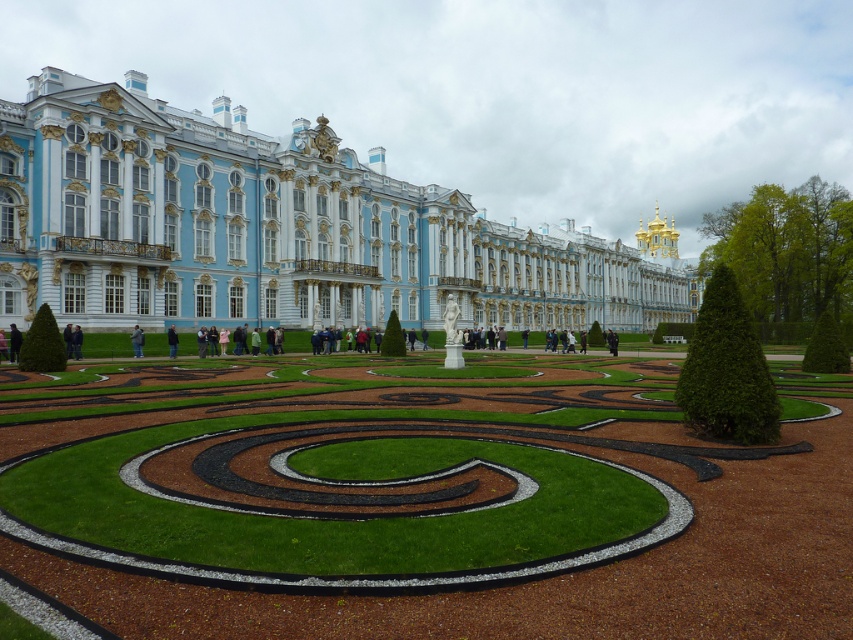
You are a visitor standing in the garden of the palace. You see the green grass at center and the dark blue jeans at center. Which object is taller?

The green grass at center is taller than the dark blue jeans at center.

You are standing in the palace garden and see the statue in the center. You want to place a dark blue fabric jacket at lower left. Is the point where you want to place it, represented by point (15, 342), located within the garden area?

The dark blue fabric jacket at lower left is represented by point (15, 342), so yes, the point is within the garden area.

In the scene shown: You are standing in front of the palace and see the green grass at center and the dark blue fabric jacket at lower left. Which object is nearer to you?

The green grass at center is closer to the viewer than the dark blue fabric jacket at lower left.